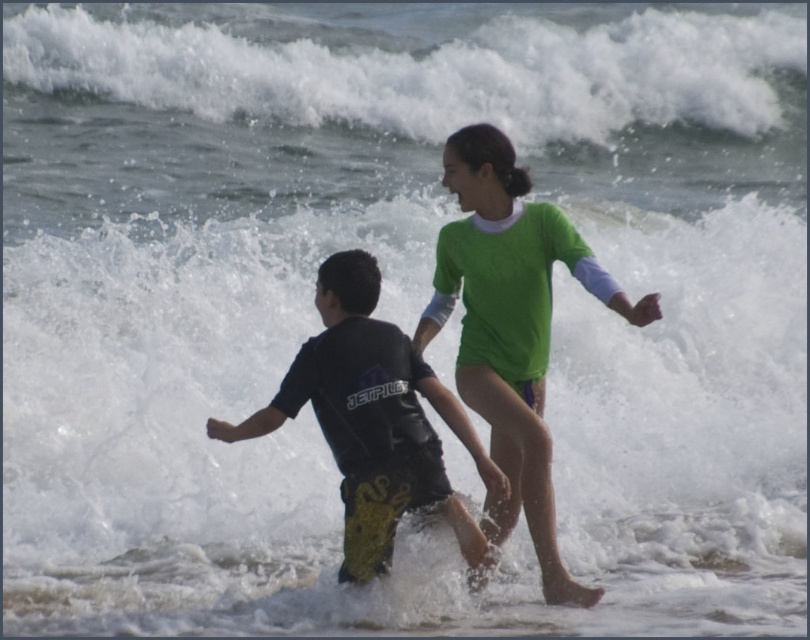
You are a photographer trying to capture the children in the ocean. You want to ensure the white frothy wave at upper center and the green fabric swimsuit at center are both visible in your shot. Which object should you focus on first to ensure both are in frame?

The white frothy wave at upper center is taller than the green fabric swimsuit at center, so focusing on the taller wave first will help ensure both are in frame.

You are a photographer trying to capture the children playing in the ocean. You want to place the white frothy wave at upper center in the center of your photo. Given that the photo frame is a rectangle with coordinates from 0 to 1 on both axes, can you adjust your camera to center the wave at the exact center point of the photo?

The white frothy wave at upper center is located at point 0.103 on the x axis and 0.526 on the y axis. The exact center of the photo is at point 0.5 on both axes. Since the wave is not at the center coordinates, you cannot center it exactly without moving the camera.

You are a photographer trying to capture the children playing in the ocean. You want to position yourself so that the white frothy wave at upper center and the black matte wetsuit at center are both in frame. Which object should you place on the left side of the photo to ensure both are visible?

You should place the black matte wetsuit at center on the left side of the photo because the white frothy wave at upper center is to the right of it, ensuring both are visible in the frame.